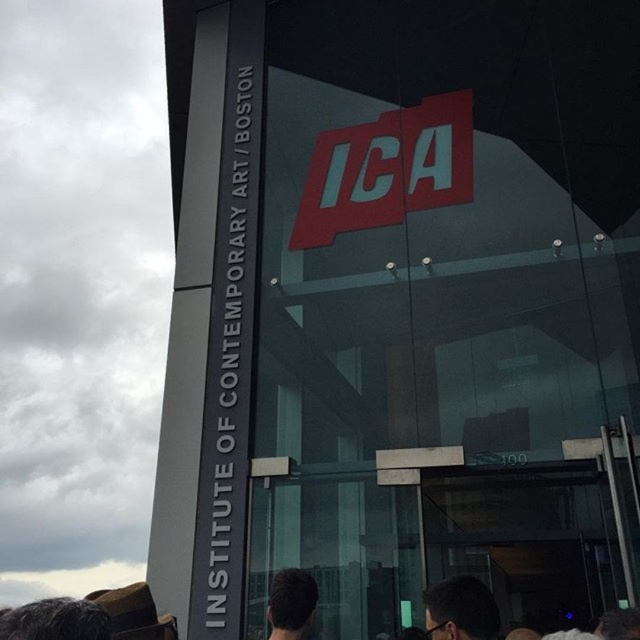
Question: Does dark brown hair at lower right have a larger size compared to dark brown hair at lower center?

Choices:
 (A) no
 (B) yes

Answer: (B)

Question: Is dark brown hair at lower right to the right of dark brown hair at lower center from the viewer's perspective?

Choices:
 (A) yes
 (B) no

Answer: (A)

Question: Is dark brown hair at lower right to the left of dark brown hair at lower center from the viewer's perspective?

Choices:
 (A) yes
 (B) no

Answer: (B)